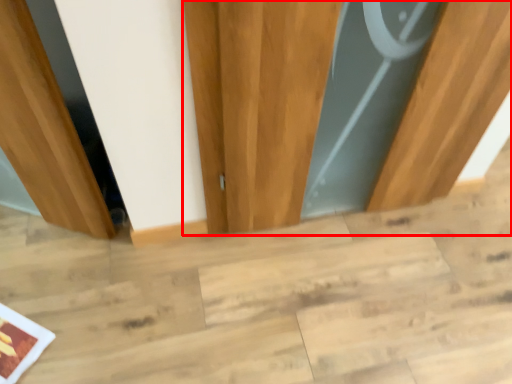
Question: Observing the image, what is the correct spatial positioning of door (annotated by the red box) in reference to stair?

Choices:
 (A) left
 (B) right

Answer: (B)